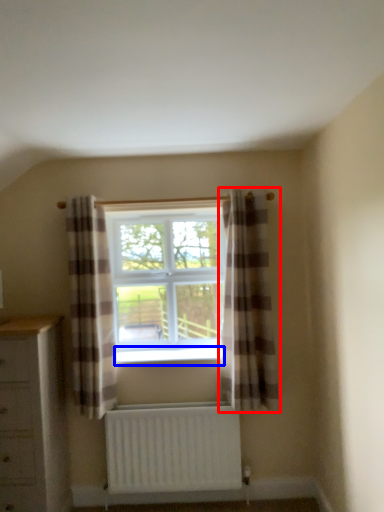
Question: Which point is further to the camera, curtain (highlighted by a red box) or window sill (highlighted by a blue box)?

Choices:
 (A) curtain
 (B) window sill

Answer: (B)